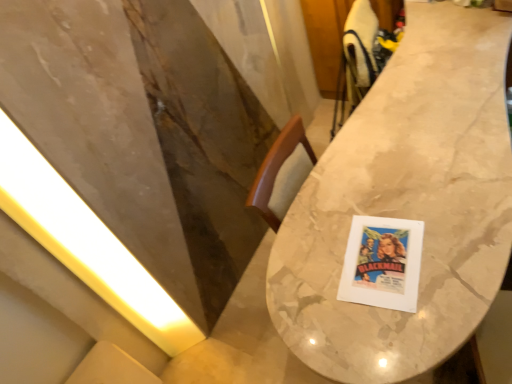
At what (x,y) coordinates should I click in order to perform the action: click on yellow matte light at left. Please return your answer as a coordinate pair (x, y). This screenshot has height=384, width=512. Looking at the image, I should click on (86, 242).

What do you see at coordinates (86, 242) in the screenshot? This screenshot has height=384, width=512. I see `yellow matte light at left` at bounding box center [86, 242].

The height and width of the screenshot is (384, 512). Describe the element at coordinates (406, 203) in the screenshot. I see `marble table at center` at that location.

The width and height of the screenshot is (512, 384). In order to click on marble table at center in this screenshot , I will do `click(406, 203)`.

Find the location of a particular element. Image resolution: width=512 pixels, height=384 pixels. yellow matte light at left is located at coordinates (86, 242).

Based on the photo, can you confirm if yellow matte light at left is positioned to the right of marble table at center?

Incorrect, yellow matte light at left is not on the right side of marble table at center.

Considering the positions of objects yellow matte light at left and marble table at center in the image provided, who is behind, yellow matte light at left or marble table at center?

yellow matte light at left is further away from the camera.

Between point (15, 211) and point (408, 334), which one is positioned in front?

Point (408, 334)

From the image's perspective, is yellow matte light at left below marble table at center?

Indeed, from the image's perspective, yellow matte light at left is shown beneath marble table at center.

From the picture: From a real-world perspective, between yellow matte light at left and marble table at center, who is vertically lower?

In real-world perspective, marble table at center is lower.

Which object is wider, yellow matte light at left or marble table at center?

marble table at center is wider.

Is yellow matte light at left shorter than marble table at center?

No.

Between yellow matte light at left and marble table at center, which one has smaller size?

yellow matte light at left.

In the scene shown: Is yellow matte light at left spatially inside marble table at center, or outside of it?

yellow matte light at left is not enclosed by marble table at center.

Are yellow matte light at left and marble table at center located far from each other?

Absolutely, yellow matte light at left is distant from marble table at center.

Is yellow matte light at left oriented towards marble table at center?

No, yellow matte light at left is not facing towards marble table at center.

Where is `table that appears in front of the yellow matte light at left`? table that appears in front of the yellow matte light at left is located at coordinates (406, 203).

Is marble table at center to the left or to the right of yellow matte light at left in the image?

Clearly, marble table at center is on the right of yellow matte light at left in the image.

Is the position of marble table at center more distant than that of yellow matte light at left?

No, marble table at center is closer to the camera.

Which is nearer, (x=454, y=308) or (x=50, y=175)?

The point (x=454, y=308) is closer.

From the image's perspective, is marble table at center beneath yellow matte light at left?

Actually, marble table at center appears above yellow matte light at left in the image.

From a real-world perspective, is marble table at center beneath yellow matte light at left?

Yes, from a real-world perspective, marble table at center is below yellow matte light at left.

Between marble table at center and yellow matte light at left, which one has larger width?

marble table at center is wider.

In terms of height, does marble table at center look taller or shorter compared to yellow matte light at left?

Considering their sizes, marble table at center has less height than yellow matte light at left.

Does marble table at center have a larger size compared to yellow matte light at left?

Yes, marble table at center is bigger than yellow matte light at left.

Is yellow matte light at left a part of marble table at center?

That's incorrect, yellow matte light at left is not inside marble table at center.

Is marble table at center with yellow matte light at left?

No, marble table at center is not next to yellow matte light at left.

Consider the image. Is marble table at center oriented towards yellow matte light at left?

No, marble table at center is not aimed at yellow matte light at left.

I want to click on table located in front of the yellow matte light at left, so click(406, 203).

Where is `table located in front of the yellow matte light at left`? The width and height of the screenshot is (512, 384). table located in front of the yellow matte light at left is located at coordinates (406, 203).

Find the location of a particular element. light located below the marble table at center (from the image's perspective) is located at coordinates (86, 242).